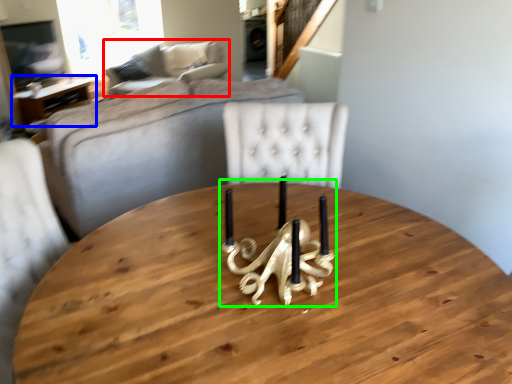
Question: Based on their relative distances, which object is nearer to couch (highlighted by a red box)? Choose from table (highlighted by a blue box) and candle holder (highlighted by a green box).

Choices:
 (A) table
 (B) candle holder

Answer: (A)